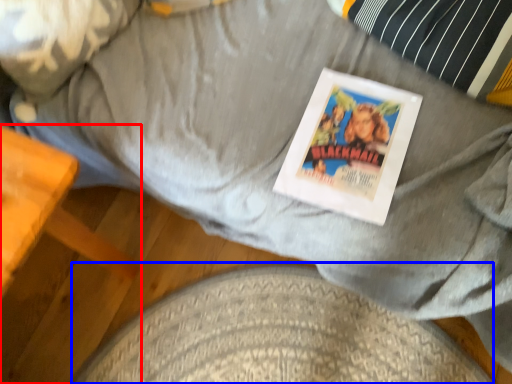
Question: Which point is further to the camera, furniture (highlighted by a red box) or dog bed (highlighted by a blue box)?

Choices:
 (A) furniture
 (B) dog bed

Answer: (B)